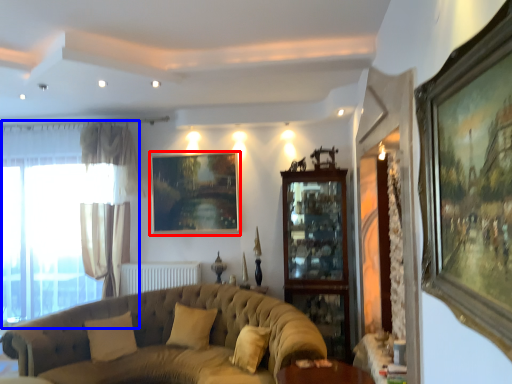
Question: Which of the following is the farthest to the observer, picture frame (highlighted by a red box) or window (highlighted by a blue box)?

Choices:
 (A) picture frame
 (B) window

Answer: (A)